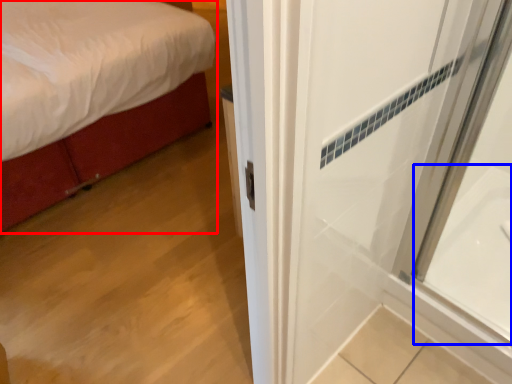
Question: Among these objects, which one is nearest to the camera, bed (highlighted by a red box) or bath (highlighted by a blue box)?

Choices:
 (A) bed
 (B) bath

Answer: (B)